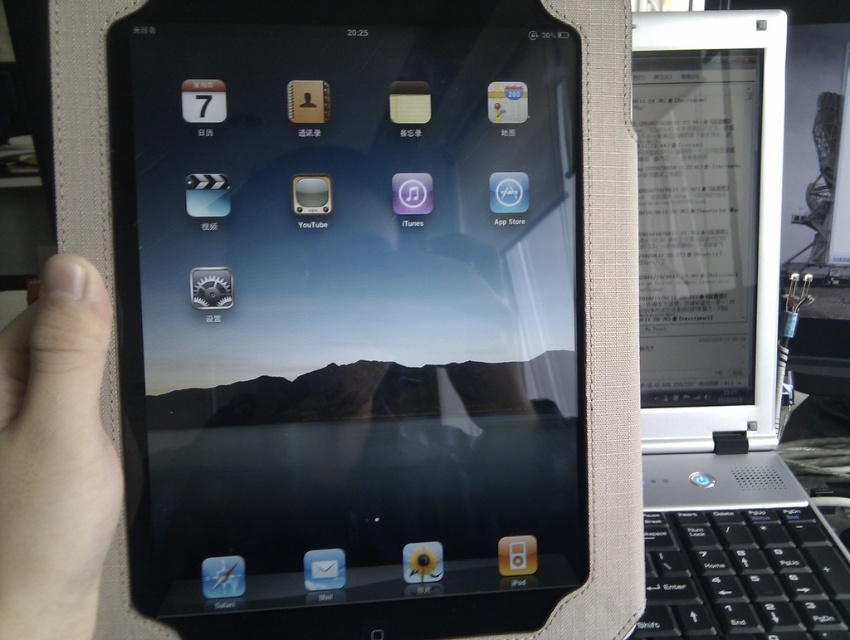
Question: Can you confirm if white plastic e-reader at right is wider than skinsmoothhand at left?

Choices:
 (A) no
 (B) yes

Answer: (B)

Question: Which point is closer to the camera?

Choices:
 (A) black plastic keyboard at lower right
 (B) skinsmoothhand at left
 (C) black matte tablet at center
 (D) white plastic e-reader at right

Answer: (B)

Question: Can you confirm if white plastic e-reader at right is wider than black plastic keyboard at lower right?

Choices:
 (A) yes
 (B) no

Answer: (A)

Question: Does black matte tablet at center come in front of white plastic e-reader at right?

Choices:
 (A) yes
 (B) no

Answer: (A)

Question: Which point is closer to the camera?

Choices:
 (A) white plastic e-reader at right
 (B) skinsmoothhand at left
 (C) black plastic keyboard at lower right
 (D) black matte tablet at center

Answer: (B)

Question: Which object is positioned farthest from the white plastic e-reader at right?

Choices:
 (A) skinsmoothhand at left
 (B) black matte tablet at center

Answer: (A)